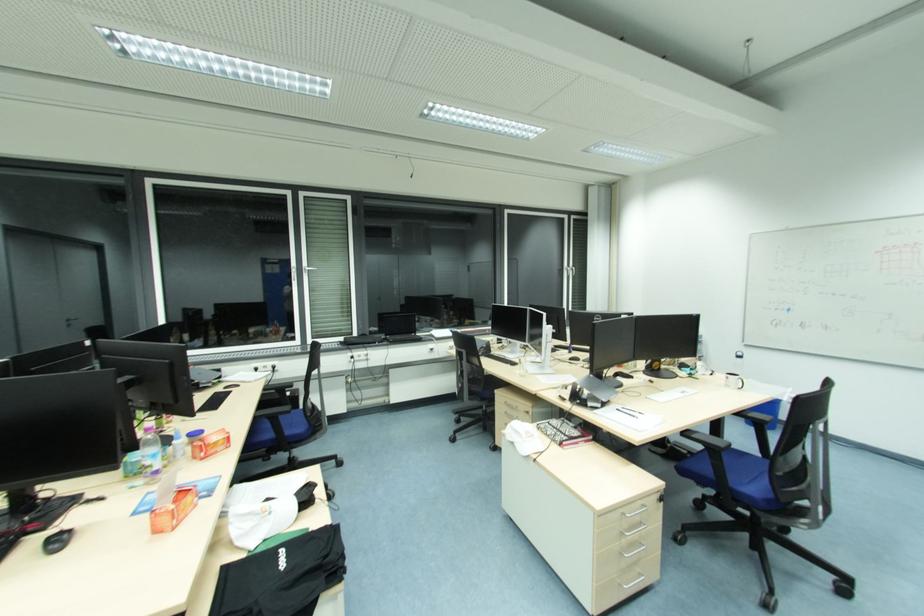
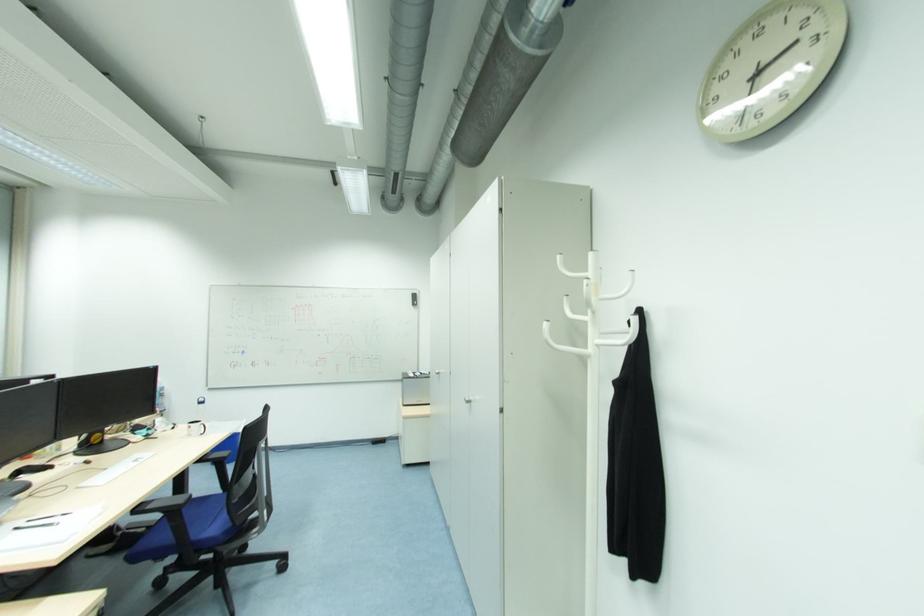
Find the pixel in the second image that matches the point at 726,456 in the first image.

(187, 512)